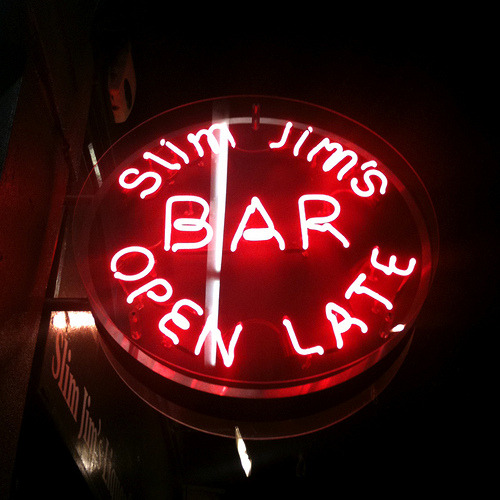
The height and width of the screenshot is (500, 500). What are the coordinates of `neon words` in the screenshot? It's located at (254, 237), (175, 151), (298, 148), (138, 292), (352, 328).